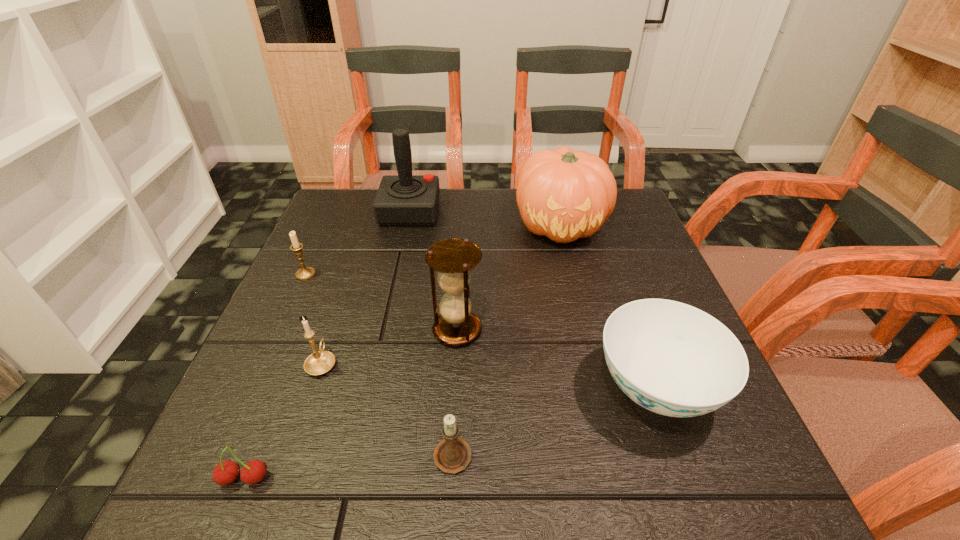
Identify which candle holder is the second nearest to the cherry. Please provide its 2D coordinates. Your answer should be formatted as a tuple, i.e. [(x, y)], where the tuple contains the x and y coordinates of a point satisfying the conditions above.

[(452, 455)]

Find the location of `free region that satisfies the following two spatial constraints: 1. on the handle side of the hourglass; 2. on the left side of the second farthest candle holder`. free region that satisfies the following two spatial constraints: 1. on the handle side of the hourglass; 2. on the left side of the second farthest candle holder is located at coordinates (333, 330).

Where is `vacant point that satisfies the following two spatial constraints: 1. on the base of the hourglass; 2. on the right side of the joystick`? Image resolution: width=960 pixels, height=540 pixels. vacant point that satisfies the following two spatial constraints: 1. on the base of the hourglass; 2. on the right side of the joystick is located at coordinates coord(383,330).

At what (x,y) coordinates should I click in order to perform the action: click on free region that satisfies the following two spatial constraints: 1. on the base of the joystick; 2. on the side of the rightmost candle holder with the handle. Please return your answer as a coordinate pair (x, y). Looking at the image, I should click on (356, 453).